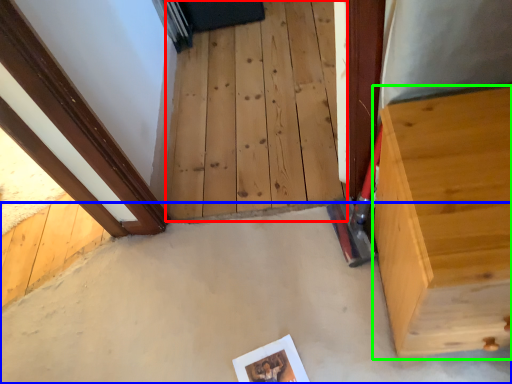
Question: Based on their relative distances, which object is nearer to stairwell (highlighted by a red box)? Choose from concrete (highlighted by a blue box) and furniture (highlighted by a green box).

Choices:
 (A) concrete
 (B) furniture

Answer: (A)